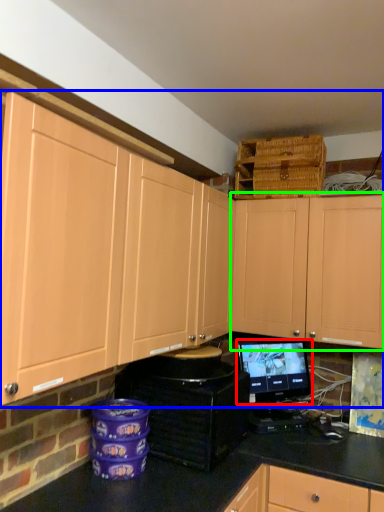
Question: Which object is the farthest from computer monitor (highlighted by a red box)? Choose among these: cabinetry (highlighted by a blue box) or cabinetry (highlighted by a green box).

Choices:
 (A) cabinetry
 (B) cabinetry

Answer: (A)